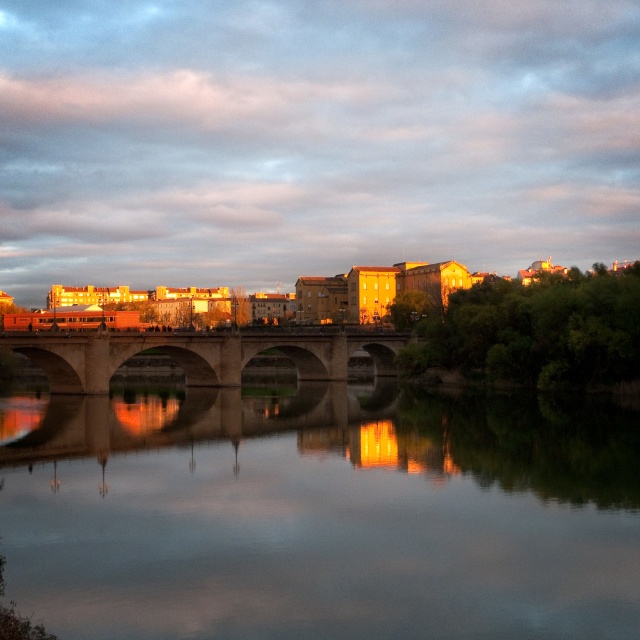
You are standing on the riverside path and want to take a photo of the stone bridge at center without any reflections. Is the smooth reflective water at center in the way of your shot?

The smooth reflective water at center is positioned under the stone bridge at center, so taking a photo from the riverside path would require angling the camera upwards to avoid capturing the reflection below the bridge.

You are an architect analyzing the riverside scene. You need to determine which object takes up more area in the image between the smooth reflective water at center and the stone bridge at center. Based on the scene description, which one is larger?

The stone bridge at center takes up more area in the image than the smooth reflective water at center, as the description states that the smooth reflective water at center occupies less space than the stone bridge at center.

Looking at this image, you are a boat captain planning to navigate a boat with a height of 10 meters through the gap between the smooth reflective water at center and the stone bridge at center. Can the boat pass under the bridge without hitting it?

The smooth reflective water at center and the stone bridge at center are 32.88 meters apart. Since the boat has a height of 10 meters, it can safely pass under the bridge as the vertical clearance is sufficient.